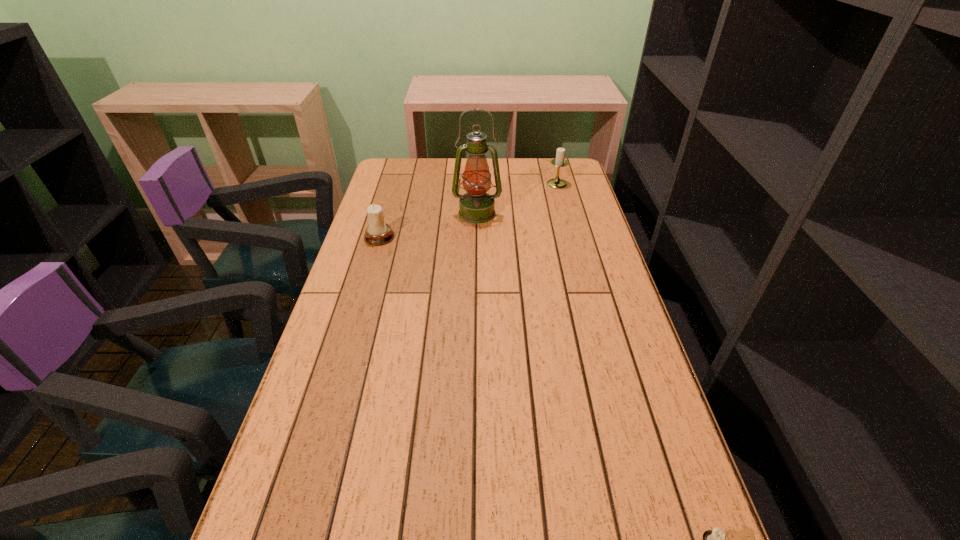
The width and height of the screenshot is (960, 540). I want to click on candle holder that stands as the closest to the oil lamp, so tap(378, 232).

At what (x,y) coordinates should I click in order to perform the action: click on candle holder that can be found as the second closest to the leftmost object. Please return your answer as a coordinate pair (x, y). The width and height of the screenshot is (960, 540). Looking at the image, I should click on tap(715, 539).

Identify the location of free space that satisfies the following two spatial constraints: 1. on the back side of the second object from left to right; 2. on the left side of the leftmost object. The width and height of the screenshot is (960, 540). (387, 213).

Find the location of a particular element. The width and height of the screenshot is (960, 540). free space that satisfies the following two spatial constraints: 1. on the back side of the farthest candle holder; 2. on the left side of the second object from left to right is located at coordinates (477, 184).

Locate an element on the screen. This screenshot has width=960, height=540. vacant region that satisfies the following two spatial constraints: 1. on the back side of the tallest candle holder; 2. on the left side of the third nearest object is located at coordinates (477, 184).